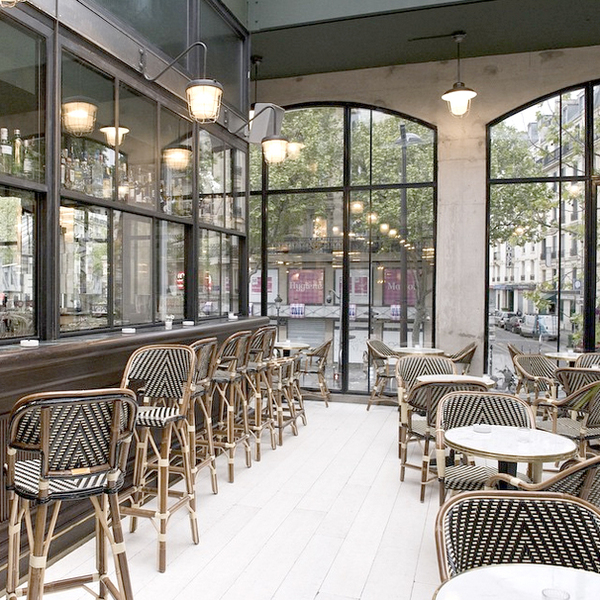
Where is `tables`? This screenshot has width=600, height=600. tables is located at coordinates point(278,344), point(428,350), point(430,377), point(497,443), point(556,353).